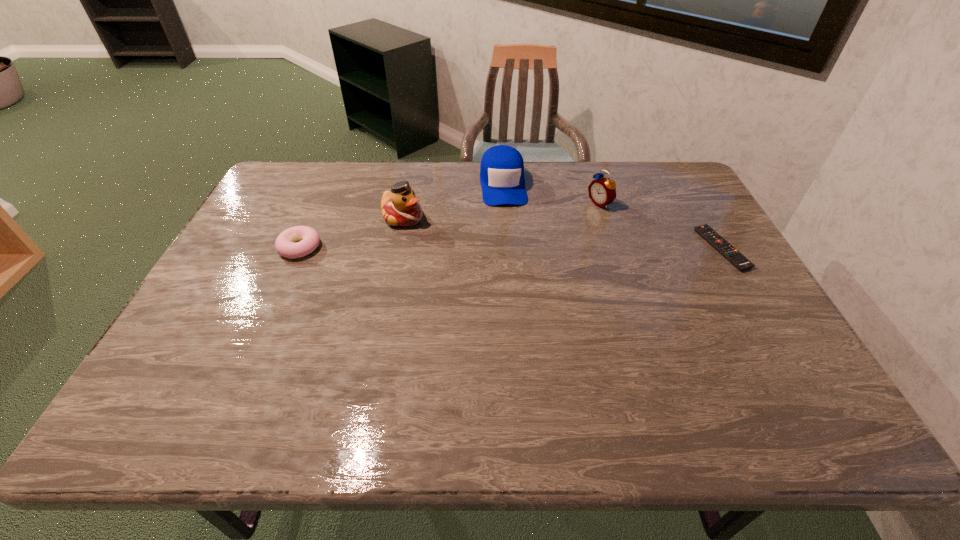
Identify the location of free space on the desktop that is between the doughnut and the rightmost object and is positioned on the front-facing side of the baseball cap. (512, 248).

Identify the location of vacant space on the desktop that is between the doughnut and the rightmost object and is positioned on the front-facing side of the alarm clock. This screenshot has height=540, width=960. (501, 248).

At what (x,y) coordinates should I click in order to perform the action: click on free spot on the desktop that is between the fourth tallest object and the shortest object and is positioned on the face of the duck. Please return your answer as a coordinate pair (x, y). The width and height of the screenshot is (960, 540). Looking at the image, I should click on (470, 248).